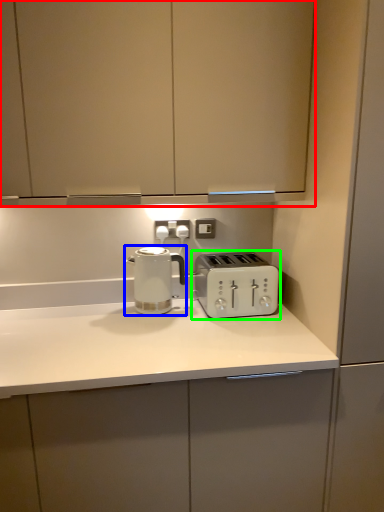
Question: Which object is the farthest from cabinetry (highlighted by a red box)? Choose among these: kettle (highlighted by a blue box) or toaster (highlighted by a green box).

Choices:
 (A) kettle
 (B) toaster

Answer: (B)